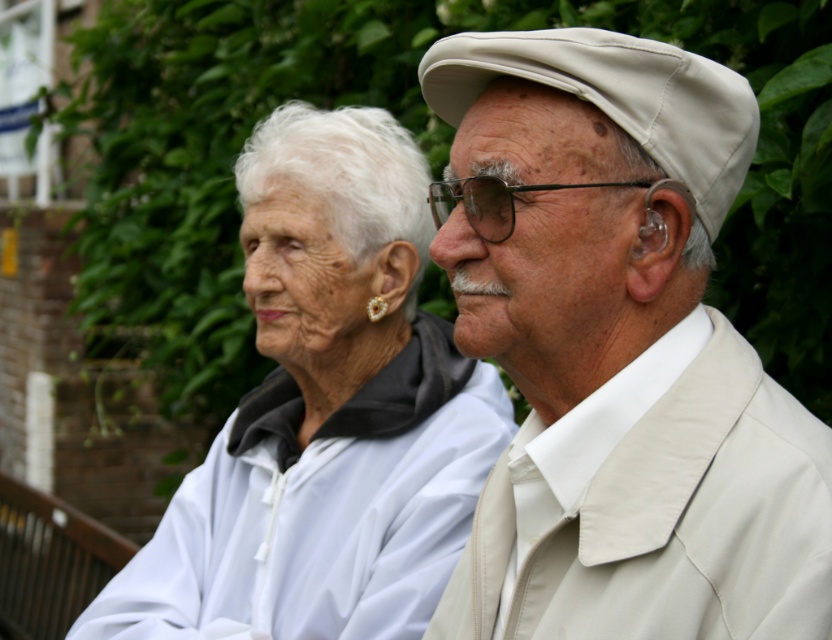
Question: Which object is positioned farthest from the black plastic goggles at center?

Choices:
 (A) white matte jacket at center
 (B) beige fabric cap at upper right

Answer: (A)

Question: Does beige fabric cap at upper right appear on the left side of white matte jacket at center?

Choices:
 (A) yes
 (B) no

Answer: (B)

Question: Which object is the farthest from the beige fabric cap at upper right?

Choices:
 (A) white matte jacket at center
 (B) black plastic goggles at center

Answer: (A)

Question: Among these points, which one is farthest from the camera?

Choices:
 (A) (439, 525)
 (B) (476, 230)

Answer: (A)

Question: Considering the relative positions of beige fabric cap at upper right and black plastic goggles at center in the image provided, where is beige fabric cap at upper right located with respect to black plastic goggles at center?

Choices:
 (A) right
 (B) left

Answer: (A)

Question: Does beige fabric cap at upper right appear over black plastic goggles at center?

Choices:
 (A) no
 (B) yes

Answer: (A)